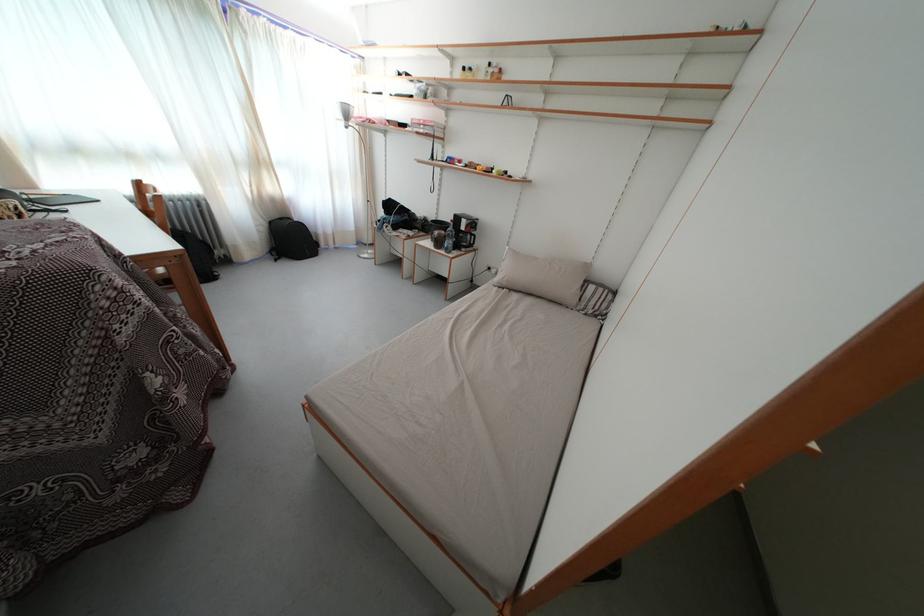
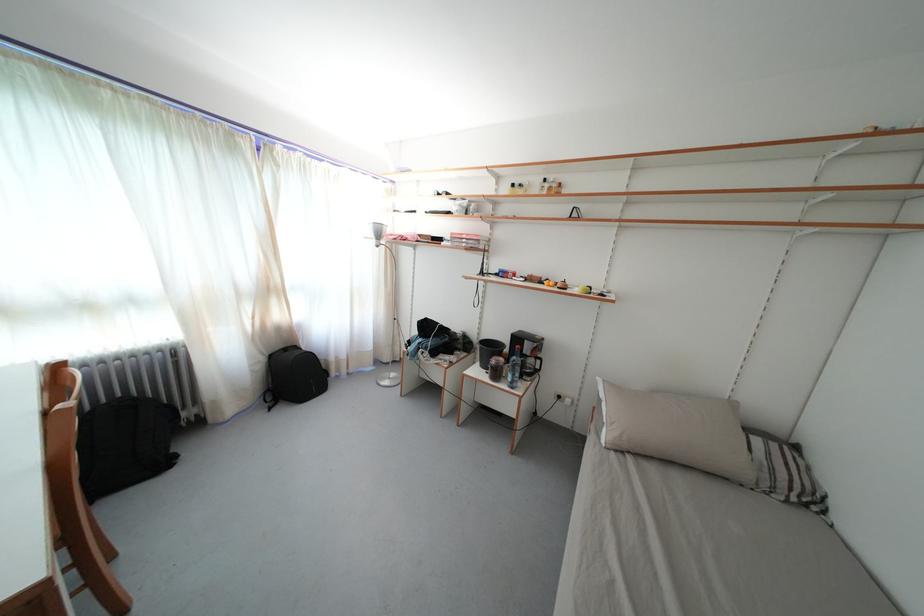
In the second image, find the point that corresponds to point 469,74 in the first image.

(518, 191)